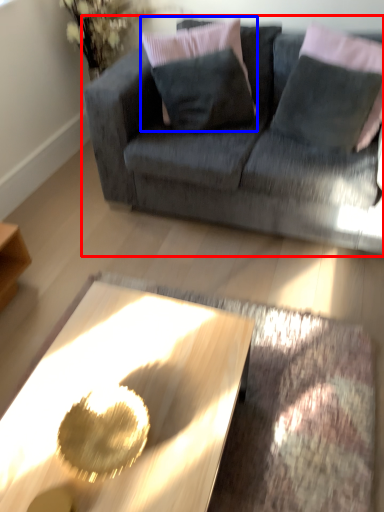
Question: Which of the following is the farthest to the observer, studio couch (highlighted by a red box) or pillow (highlighted by a blue box)?

Choices:
 (A) studio couch
 (B) pillow

Answer: (B)